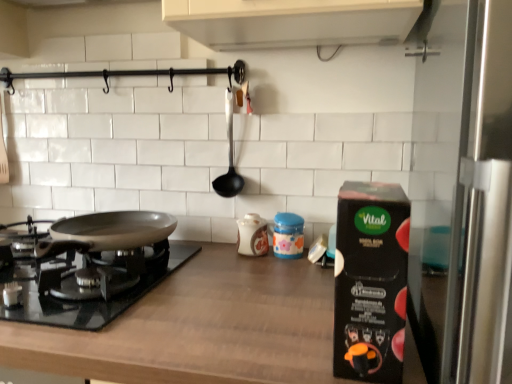
Image resolution: width=512 pixels, height=384 pixels. In order to click on free space in front of matte ceramic jar at center, arranged as the 1th kitchen appliance when viewed from the left in this screenshot , I will do `click(255, 272)`.